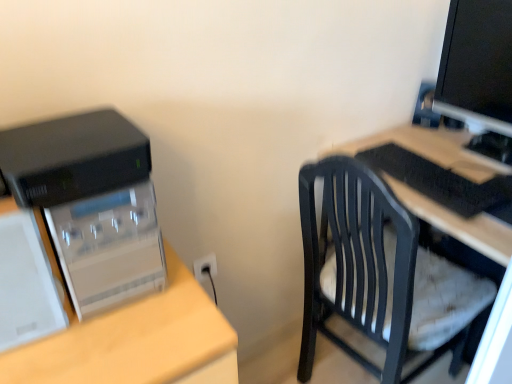
Question: Considering the positions of black plastic chair at right and black plastic keyboard at right in the image, is black plastic chair at right bigger or smaller than black plastic keyboard at right?

Choices:
 (A) big
 (B) small

Answer: (A)

Question: Looking at their shapes, would you say black plastic chair at right is wider or thinner than black plastic keyboard at right?

Choices:
 (A) wide
 (B) thin

Answer: (A)

Question: Based on their relative distances, which object is farther from the black plastic electric outlet at center?

Choices:
 (A) black plastic chair at right
 (B) black plastic keyboard at right
 (C) black glossy monitor at upper right
 (D) black plastic computer tower at left

Answer: (C)

Question: Which of these objects is positioned closest to the black plastic computer tower at left?

Choices:
 (A) black glossy monitor at upper right
 (B) black plastic electric outlet at center
 (C) black plastic chair at right
 (D) black plastic keyboard at right

Answer: (C)